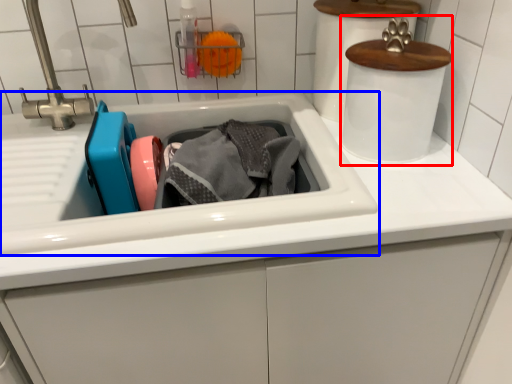
Question: Which object is closer to the camera taking this photo, appliance (highlighted by a red box) or sink (highlighted by a blue box)?

Choices:
 (A) appliance
 (B) sink

Answer: (B)